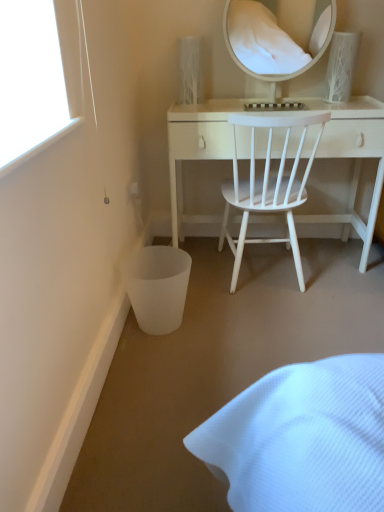
Identify the location of vacant space in front of white textured vase at upper right. (359, 106).